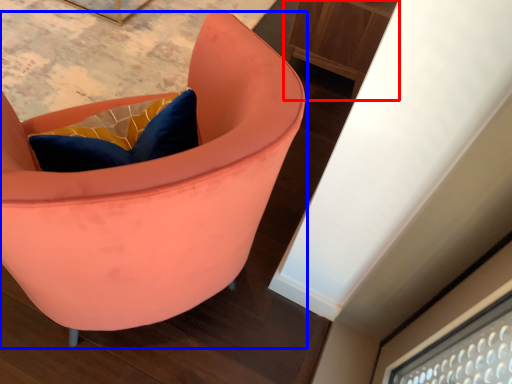
Question: Which of the following is the farthest to the observer, furniture (highlighted by a red box) or chair (highlighted by a blue box)?

Choices:
 (A) furniture
 (B) chair

Answer: (A)